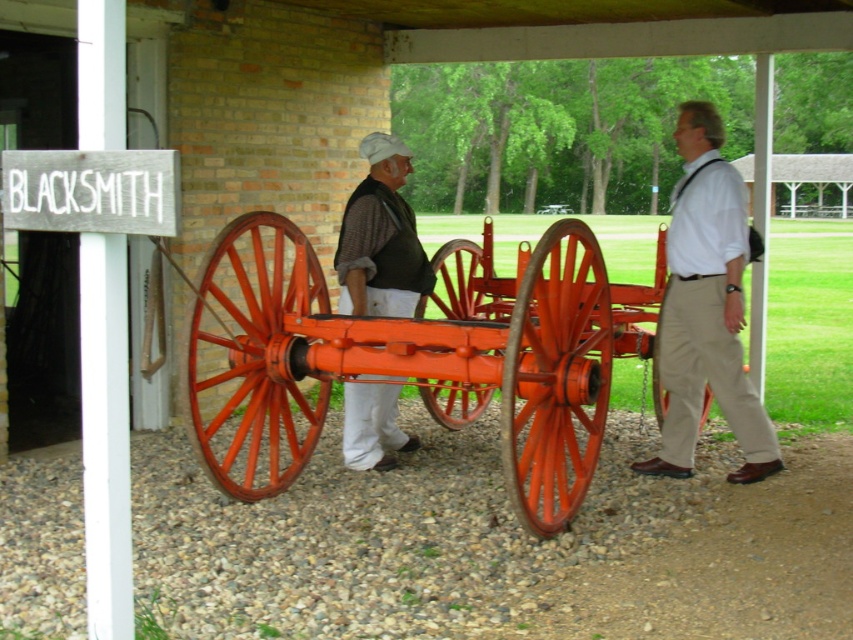
Question: Can you confirm if orange polished wood cart at center is positioned below matte white shirt at right?

Choices:
 (A) yes
 (B) no

Answer: (A)

Question: Is matte white shirt at right bigger than matte brown vest at center?

Choices:
 (A) no
 (B) yes

Answer: (B)

Question: Which of the following is the closest to the observer?

Choices:
 (A) (350, 198)
 (B) (454, 413)
 (C) (686, 458)

Answer: (A)

Question: Observing the image, what is the correct spatial positioning of orange polished wood cart at center in reference to matte white shirt at right?

Choices:
 (A) right
 (B) left

Answer: (B)

Question: Which point is closer to the camera?

Choices:
 (A) orange polished wood cart at center
 (B) matte brown vest at center
 (C) matte white shirt at right

Answer: (A)

Question: Which point appears farthest from the camera in this image?

Choices:
 (A) (689, 246)
 (B) (531, 397)
 (C) (379, 189)

Answer: (C)